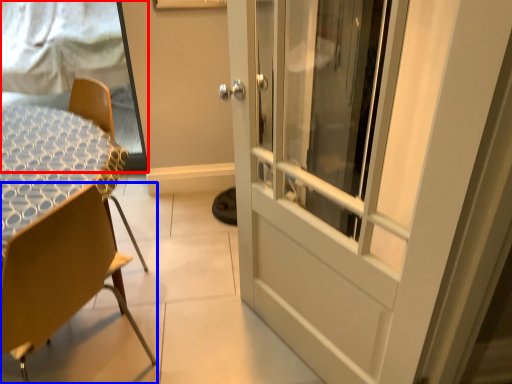
Question: Which object appears farthest to the camera in this image, window screen (highlighted by a red box) or chair (highlighted by a blue box)?

Choices:
 (A) window screen
 (B) chair

Answer: (A)